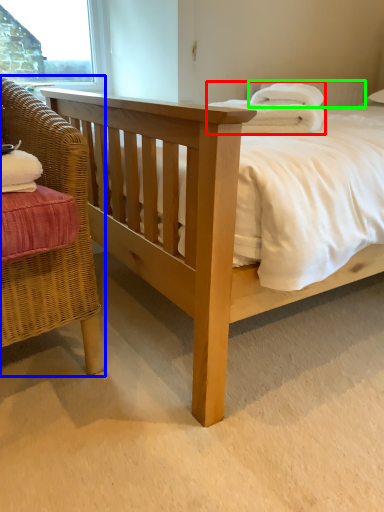
Question: Which is nearer to the bath towel (highlighted by a red box)? chair (highlighted by a blue box) or pillow (highlighted by a green box).

Choices:
 (A) chair
 (B) pillow

Answer: (A)